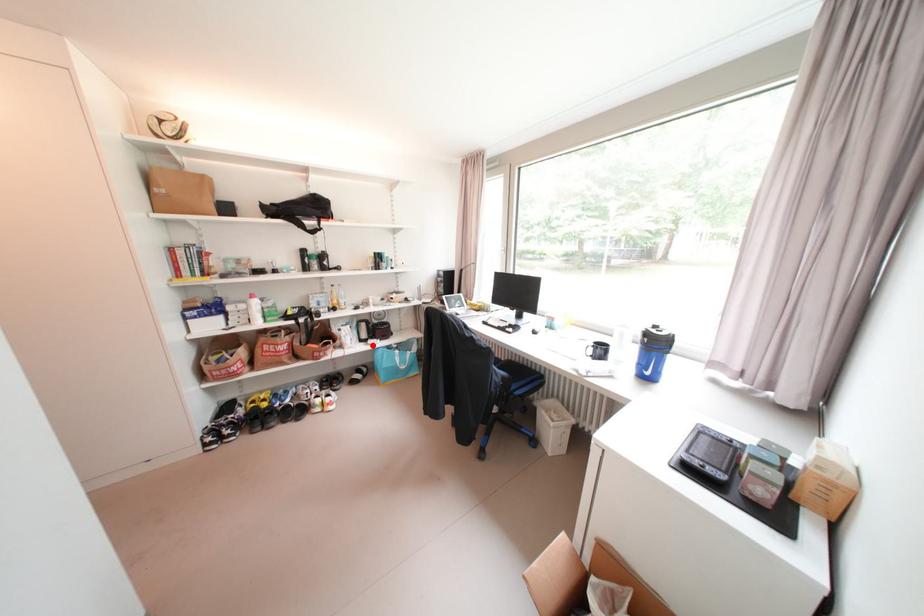
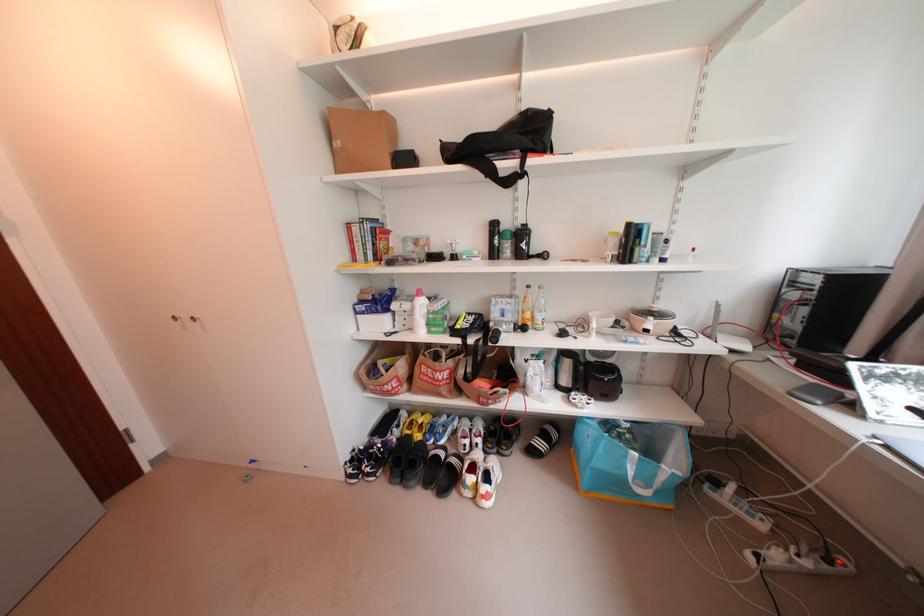
Question: I am providing you with two images of the same scene from different viewpoints. Given a red point in image1, look at the same physical point in image2. Is it:

Choices:
 (A) Closer to the viewpoint
 (B) Farther from the viewpoint

Answer: (B)